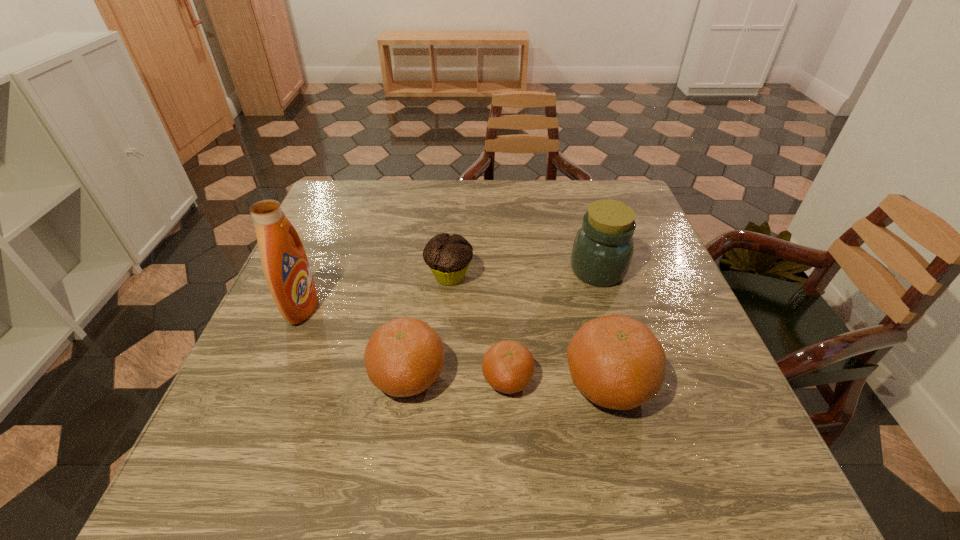
Locate an element on the screen. This screenshot has height=540, width=960. vacant space that's between the rightmost clementine and the muffin is located at coordinates (529, 330).

Identify the location of the fifth closest object to the shortest clementine. (285, 265).

Choose which object is the fifth nearest neighbor to the muffin. Please provide its 2D coordinates. Your answer should be formatted as a tuple, i.e. [(x, y)], where the tuple contains the x and y coordinates of a point satisfying the conditions above.

[(615, 361)]

Locate an element on the screen. The height and width of the screenshot is (540, 960). clementine that is the third closest one to the second tallest object is located at coordinates (403, 357).

Locate which clementine is the closest to the rightmost clementine. Please provide its 2D coordinates. Your answer should be formatted as a tuple, i.e. [(x, y)], where the tuple contains the x and y coordinates of a point satisfying the conditions above.

[(508, 366)]

The height and width of the screenshot is (540, 960). I want to click on free location that satisfies the following two spatial constraints: 1. on the back side of the third object from right to left; 2. on the front-facing side of the detergent, so click(x=503, y=307).

The height and width of the screenshot is (540, 960). I want to click on vacant point that satisfies the following two spatial constraints: 1. on the front-facing side of the rightmost clementine; 2. on the left side of the tallest object, so click(271, 383).

Where is `blank space that satisfies the following two spatial constraints: 1. on the front-facing side of the rightmost clementine; 2. on the left side of the detergent`? This screenshot has height=540, width=960. blank space that satisfies the following two spatial constraints: 1. on the front-facing side of the rightmost clementine; 2. on the left side of the detergent is located at coordinates (271, 383).

Locate an element on the screen. The image size is (960, 540). free point that satisfies the following two spatial constraints: 1. on the back side of the second tallest object; 2. on the right side of the leftmost clementine is located at coordinates (422, 271).

The width and height of the screenshot is (960, 540). I want to click on free space that satisfies the following two spatial constraints: 1. on the front-facing side of the leftmost clementine; 2. on the right side of the tallest object, so pyautogui.click(x=274, y=375).